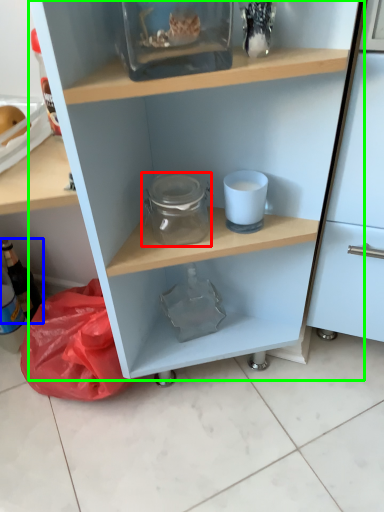
Question: Considering the real-world distances, which object is closest to glass jar (highlighted by a red box)? bottle (highlighted by a blue box) or shelf (highlighted by a green box).

Choices:
 (A) bottle
 (B) shelf

Answer: (B)